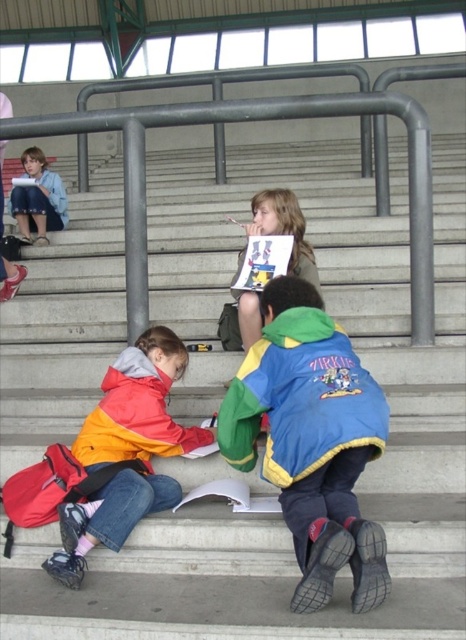
Between point (276, 289) and point (137, 388), which one is positioned in front?

Positioned in front is point (276, 289).

Is blue fleece jacket at center smaller than orange/yellow jacket at lower left?

Actually, blue fleece jacket at center might be larger than orange/yellow jacket at lower left.

I want to click on blue fleece jacket at center, so click(312, 440).

Image resolution: width=466 pixels, height=640 pixels. I want to click on blue fleece jacket at center, so click(x=312, y=440).

Is point (169, 428) positioned in front of point (11, 202)?

Yes.

Who is shorter, orange fleece jacket at lower left or denim jacket at upper left?

orange fleece jacket at lower left is shorter.

Between point (158, 396) and point (22, 163), which one is positioned behind?

Positioned behind is point (22, 163).

I want to click on orange fleece jacket at lower left, so pyautogui.click(x=134, y=417).

Who is positioned more to the left, blue fleece jacket at center or denim jacket at upper left?

From the viewer's perspective, denim jacket at upper left appears more on the left side.

Consider the image. Can you confirm if blue fleece jacket at center is thinner than denim jacket at upper left?

No, blue fleece jacket at center is not thinner than denim jacket at upper left.

Looking at this image, measure the distance between blue fleece jacket at center and camera.

The distance of blue fleece jacket at center from camera is 2.71 meters.

Identify the location of blue fleece jacket at center. pyautogui.click(x=312, y=440).